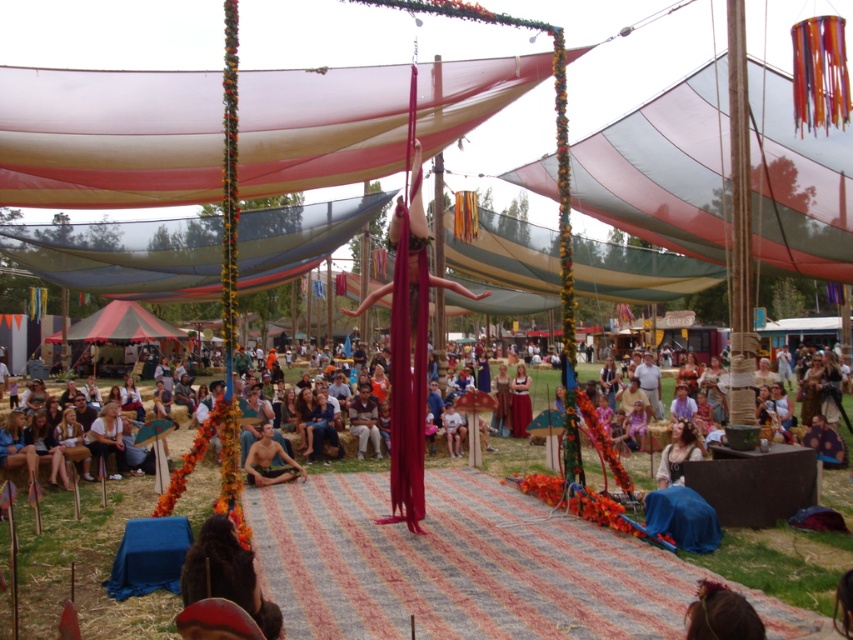
You are an event planner trying to ensure safety during the festival. You notice two performers at the center stage area. The smooth skin person at center and the shiny metallic meditating person at center. Which performer is closer to the audience for better visibility?

The smooth skin person at center is closer to the audience because they are positioned in front of the shiny metallic meditating person at center.